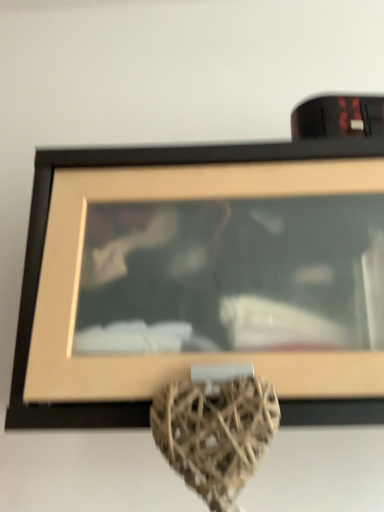
The height and width of the screenshot is (512, 384). What are the coordinates of `brown wicker heart at center` in the screenshot? It's located at (215, 430).

What do you see at coordinates (215, 430) in the screenshot? I see `brown wicker heart at center` at bounding box center [215, 430].

Identify the location of wooden frame at upper center. (203, 279).

What is the approximate height of wooden frame at upper center?

The height of wooden frame at upper center is 39.14 centimeters.

What do you see at coordinates (203, 279) in the screenshot? This screenshot has height=512, width=384. I see `wooden frame at upper center` at bounding box center [203, 279].

Locate an element on the screen. Image resolution: width=384 pixels, height=512 pixels. brown wicker heart at center is located at coordinates (215, 430).

Does brown wicker heart at center appear on the right side of wooden frame at upper center?

Incorrect, brown wicker heart at center is not on the right side of wooden frame at upper center.

Considering their positions, is brown wicker heart at center located in front of or behind wooden frame at upper center?

Clearly, brown wicker heart at center is in front of wooden frame at upper center.

Does point (234, 466) come closer to viewer compared to point (52, 258)?

That is True.

From the picture: From the image's perspective, who appears lower, brown wicker heart at center or wooden frame at upper center?

brown wicker heart at center is shown below in the image.

From a real-world perspective, is brown wicker heart at center above or below wooden frame at upper center?

From a real-world perspective, brown wicker heart at center is physically below wooden frame at upper center.

In terms of width, does brown wicker heart at center look wider or thinner when compared to wooden frame at upper center?

brown wicker heart at center is thinner than wooden frame at upper center.

Does brown wicker heart at center have a greater height compared to wooden frame at upper center?

Indeed, brown wicker heart at center has a greater height compared to wooden frame at upper center.

Between brown wicker heart at center and wooden frame at upper center, which one has larger size?

wooden frame at upper center is bigger.

Is brown wicker heart at center positioned beyond the bounds of wooden frame at upper center?

Indeed, brown wicker heart at center is completely outside wooden frame at upper center.

Is brown wicker heart at center placed right next to wooden frame at upper center?

brown wicker heart at center is not next to wooden frame at upper center, and they're not touching.

Is brown wicker heart at center aimed at wooden frame at upper center?

No.

How many degrees apart are the facing directions of brown wicker heart at center and wooden frame at upper center?

brown wicker heart at center and wooden frame at upper center are facing 0.00175 degrees away from each other.

Find the location of a particular element. The image size is (384, 512). vase below the wooden frame at upper center (from a real-world perspective) is located at coordinates (215, 430).

Does wooden frame at upper center appear on the left side of brown wicker heart at center?

In fact, wooden frame at upper center is to the right of brown wicker heart at center.

Relative to brown wicker heart at center, is wooden frame at upper center in front or behind?

wooden frame at upper center is positioned farther from the viewer than brown wicker heart at center.

Is point (271, 149) closer or farther from the camera than point (207, 438)?

Point (271, 149) appears to be farther away from the viewer than point (207, 438).

From the image's perspective, would you say wooden frame at upper center is shown under brown wicker heart at center?

Actually, wooden frame at upper center appears above brown wicker heart at center in the image.

From a real-world perspective, which is physically above, wooden frame at upper center or brown wicker heart at center?

wooden frame at upper center is physically above.

Based on the photo, between wooden frame at upper center and brown wicker heart at center, which one has larger width?

With larger width is wooden frame at upper center.

Considering the relative sizes of wooden frame at upper center and brown wicker heart at center in the image provided, is wooden frame at upper center shorter than brown wicker heart at center?

Yes, wooden frame at upper center is shorter than brown wicker heart at center.

Considering the sizes of wooden frame at upper center and brown wicker heart at center in the image, is wooden frame at upper center bigger or smaller than brown wicker heart at center?

In the image, wooden frame at upper center appears to be larger than brown wicker heart at center.

Would you say wooden frame at upper center is outside brown wicker heart at center?

Yes, wooden frame at upper center is not within brown wicker heart at center.

Is wooden frame at upper center not close to brown wicker heart at center?

No, wooden frame at upper center is not far away from brown wicker heart at center.

Is wooden frame at upper center facing away from brown wicker heart at center?

That's not correct — wooden frame at upper center is not looking away from brown wicker heart at center.

How many degrees apart are the facing directions of wooden frame at upper center and brown wicker heart at center?

The angular difference between wooden frame at upper center and brown wicker heart at center is 0.00175 degrees.

The width and height of the screenshot is (384, 512). Find the location of `picture frame above the brown wicker heart at center (from a real-world perspective)`. picture frame above the brown wicker heart at center (from a real-world perspective) is located at coordinates (203, 279).

This screenshot has width=384, height=512. I want to click on vase located in front of the wooden frame at upper center, so click(215, 430).

The height and width of the screenshot is (512, 384). Identify the location of picture frame lying above the brown wicker heart at center (from the image's perspective). (203, 279).